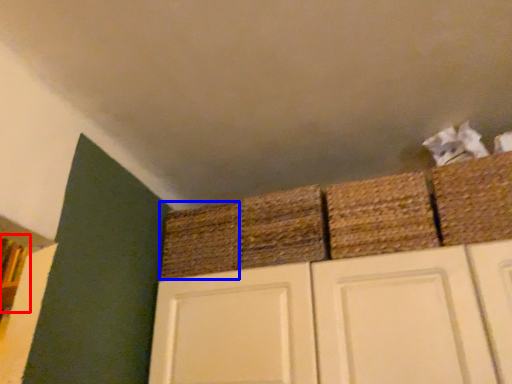
Question: Which object is closer to the camera taking this photo, shelf (highlighted by a red box) or basket (highlighted by a blue box)?

Choices:
 (A) shelf
 (B) basket

Answer: (B)